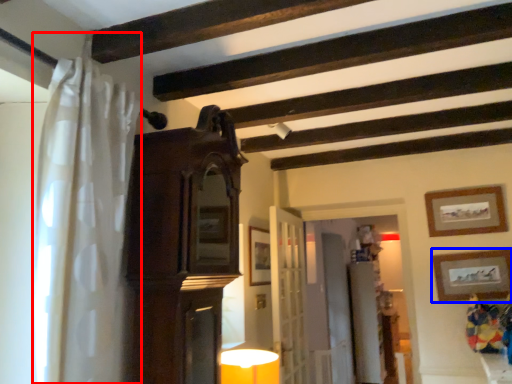
Question: Which point is further to the camera, shower curtain (highlighted by a red box) or picture frame (highlighted by a blue box)?

Choices:
 (A) shower curtain
 (B) picture frame

Answer: (B)